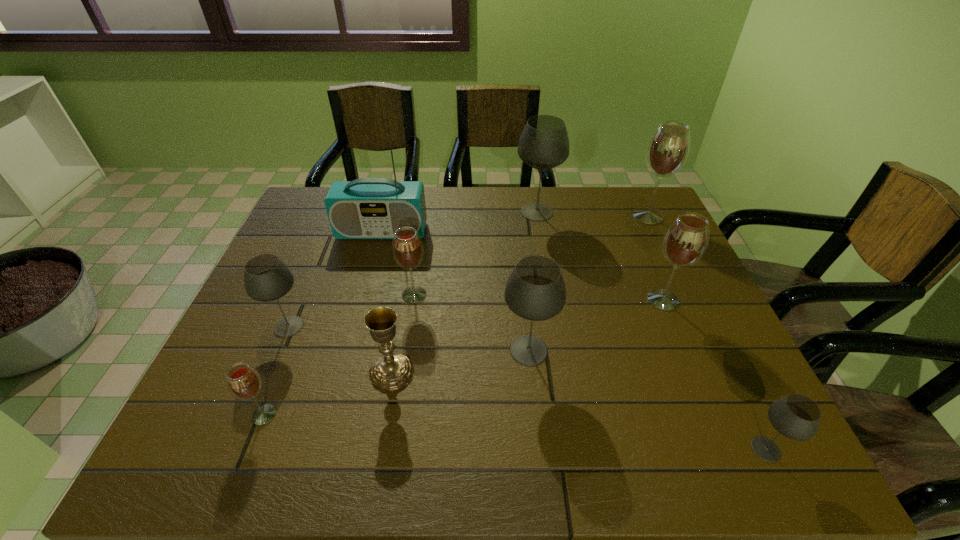
I want to click on radio receiver, so [x=366, y=208].

Where is `light radio receiver`? Image resolution: width=960 pixels, height=540 pixels. light radio receiver is located at coordinates (366, 208).

Where is `the biggest gray wineglass`? the biggest gray wineglass is located at coordinates (544, 144).

Locate an element on the screen. the biggest red wineglass is located at coordinates (668, 149).

Locate an element on the screen. the third smallest gray wineglass is located at coordinates (535, 291).

Image resolution: width=960 pixels, height=540 pixels. Identify the location of the third smallest red wineglass. (685, 242).

Identify the location of the sixth wineglass from right to left. (407, 248).

At what (x,y) coordinates should I click in order to perform the action: click on the third biggest red wineglass. Please return your answer as a coordinate pair (x, y). The width and height of the screenshot is (960, 540). Looking at the image, I should click on (407, 248).

At what (x,y) coordinates should I click in order to perform the action: click on the leftmost gray wineglass. Please return your answer as a coordinate pair (x, y). The width and height of the screenshot is (960, 540). Looking at the image, I should click on pyautogui.click(x=266, y=278).

Locate an element on the screen. chalice is located at coordinates (391, 372).